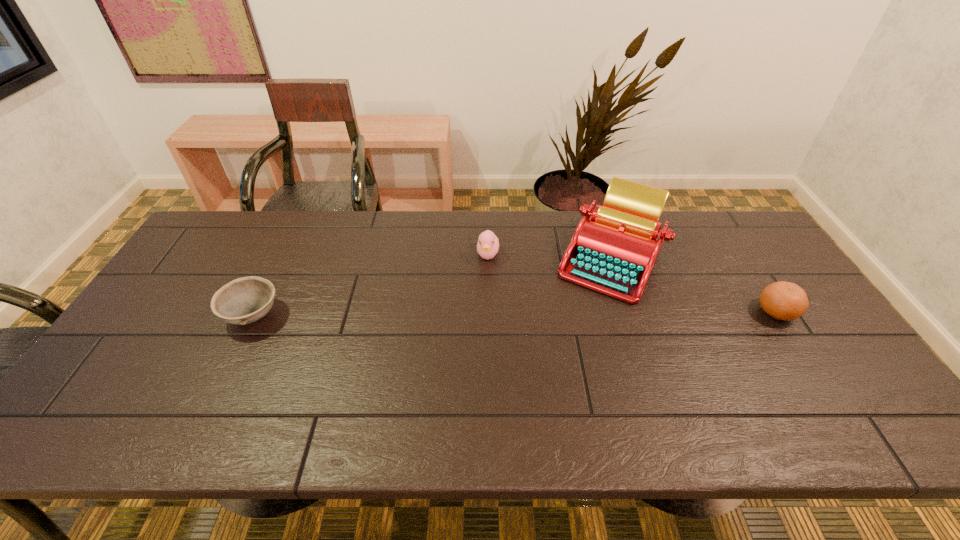
You are a GUI agent. You are given a task and a screenshot of the screen. Output one action in this format:
    pyautogui.click(x=<x>, y=<y>)
    Task: Click on the free space located on the front-facing side of the third object from right to left
    Image resolution: width=960 pixels, height=540 pixels.
    Given the screenshot: What is the action you would take?
    pyautogui.click(x=488, y=305)

I want to click on vacant space located on the typing side of the typewriter, so click(543, 294).

Where is `vacant space located 0.310m on the typing side of the typewriter`? The height and width of the screenshot is (540, 960). vacant space located 0.310m on the typing side of the typewriter is located at coordinates (479, 325).

You are a GUI agent. You are given a task and a screenshot of the screen. Output one action in this format:
    pyautogui.click(x=<x>, y=<y>)
    Task: Click on the blank space located 0.210m on the typing side of the typewriter
    Image resolution: width=960 pixels, height=540 pixels.
    Given the screenshot: What is the action you would take?
    pyautogui.click(x=510, y=310)

Locate an element on the screen. duckling that is at the far edge is located at coordinates (488, 244).

This screenshot has width=960, height=540. Find the location of `typewriter that is at the far edge`. typewriter that is at the far edge is located at coordinates (613, 250).

I want to click on object present at the right edge, so click(782, 300).

Identify the location of vacant space at the far edge of the desktop. (427, 237).

Where is `free location at the near edge of the desktop`? free location at the near edge of the desktop is located at coordinates pos(591,396).

Where is `vacant space at the left edge of the desktop`? vacant space at the left edge of the desktop is located at coordinates (148, 318).